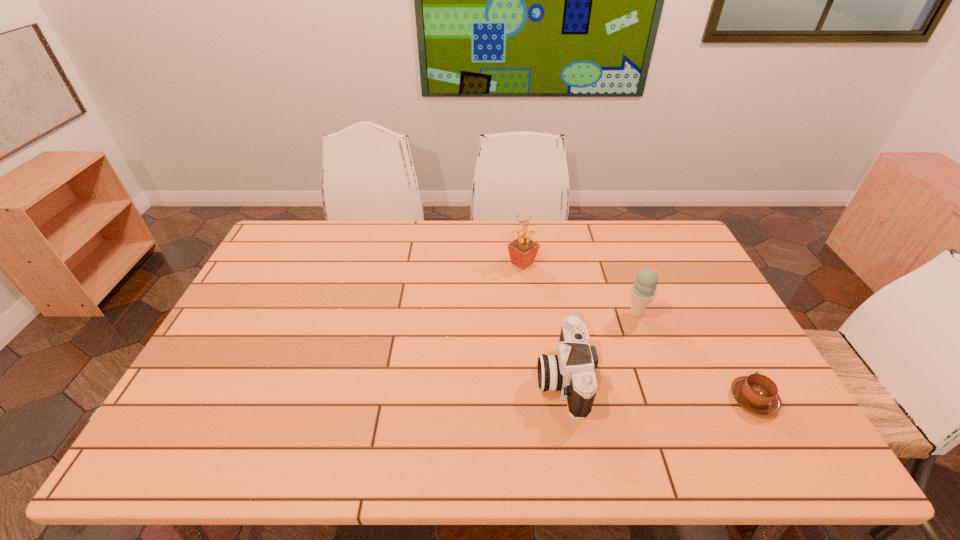
Locate an element on the screen. The height and width of the screenshot is (540, 960). vacant area at the far right corner of the desktop is located at coordinates (650, 259).

Where is `free space between the farthest object and the ice cream`? Image resolution: width=960 pixels, height=540 pixels. free space between the farthest object and the ice cream is located at coordinates (579, 288).

This screenshot has width=960, height=540. I want to click on free space between the camera and the rightmost object, so click(x=658, y=389).

I want to click on free space between the farthest object and the camera, so click(x=542, y=321).

This screenshot has height=540, width=960. What are the coordinates of `vacant area that lies between the ice cream and the cappuccino` in the screenshot? It's located at (695, 356).

In order to click on free area in between the second farthest object and the sunflower in this screenshot , I will do `click(579, 288)`.

The image size is (960, 540). In order to click on unoccupied area between the rightmost object and the sunflower in this screenshot , I will do `click(637, 331)`.

This screenshot has height=540, width=960. Find the location of `free space that is in between the rightmost object and the farthest object`. free space that is in between the rightmost object and the farthest object is located at coordinates (637, 331).

Locate an element on the screen. This screenshot has width=960, height=540. vacant area that lies between the farthest object and the cappuccino is located at coordinates (637, 331).

Locate an element on the screen. The height and width of the screenshot is (540, 960). free spot between the camera and the shortest object is located at coordinates (658, 389).